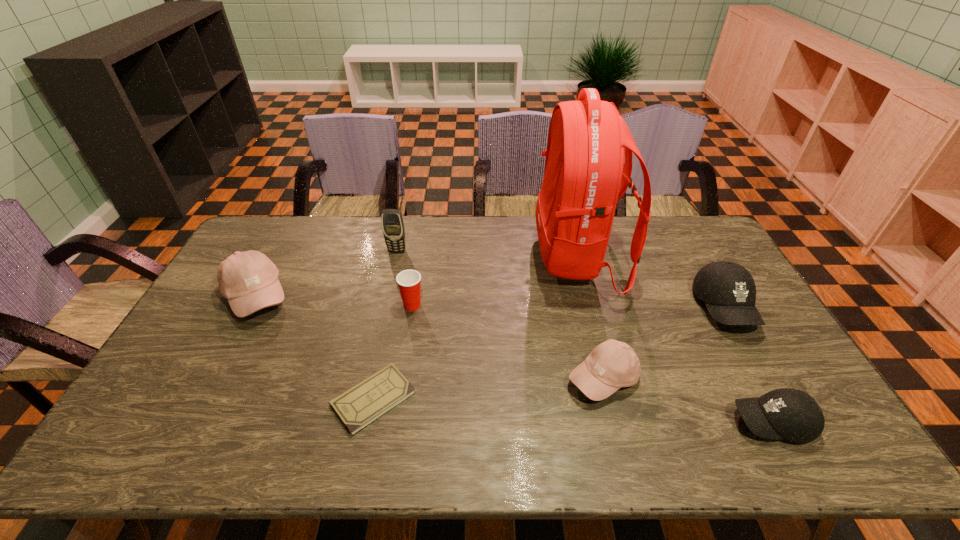
Where is `free space at the near edge`? Image resolution: width=960 pixels, height=540 pixels. free space at the near edge is located at coordinates (x=467, y=444).

The width and height of the screenshot is (960, 540). I want to click on blank area at the left edge, so point(205,331).

Locate an element on the screen. The image size is (960, 540). free spot at the right edge of the desktop is located at coordinates (704, 263).

In the image, there is a desktop. What are the coordinates of `vacant space at the far right corner` in the screenshot? It's located at (688, 249).

Find the location of a particular element. vacant space in between the smaller black baseball cap and the nearer pink baseball cap is located at coordinates (687, 400).

Locate an element on the screen. Image resolution: width=960 pixels, height=540 pixels. vacant point located between the tallest object and the second tallest object is located at coordinates click(488, 254).

Find the location of `unoccupied area between the farther black baseball cap and the tallest object`. unoccupied area between the farther black baseball cap and the tallest object is located at coordinates (651, 283).

Where is `free space between the smaller pink baseball cap and the bigger black baseball cap`? The height and width of the screenshot is (540, 960). free space between the smaller pink baseball cap and the bigger black baseball cap is located at coordinates (664, 343).

Where is `vacant space in between the second tallest object and the nearer black baseball cap`? The height and width of the screenshot is (540, 960). vacant space in between the second tallest object and the nearer black baseball cap is located at coordinates (585, 336).

At what (x,y) coordinates should I click in order to perform the action: click on vacant area that lies between the cellular telephone and the backpack. Please return your answer as a coordinate pair (x, y). Looking at the image, I should click on (488, 254).